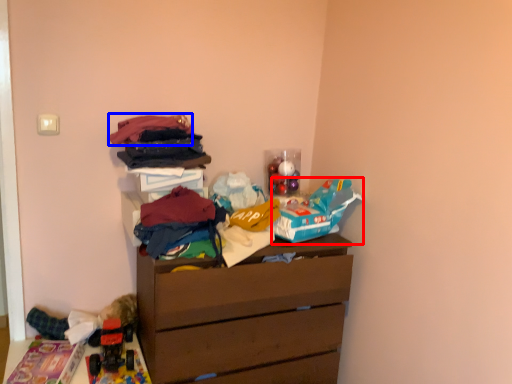
Question: Which object appears farthest to the camera in this image, toy (highlighted by a red box) or clothing (highlighted by a blue box)?

Choices:
 (A) toy
 (B) clothing

Answer: (A)